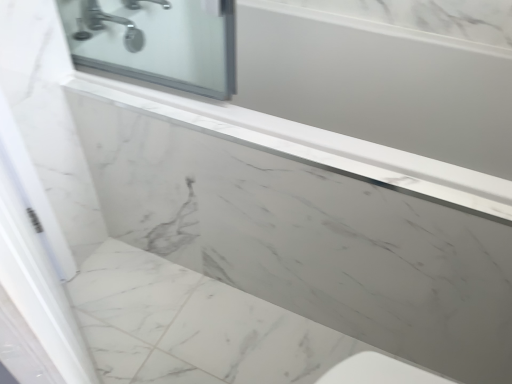
Image resolution: width=512 pixels, height=384 pixels. I want to click on vacant space underneath white marble screen door at left (from a real-world perspective), so click(84, 340).